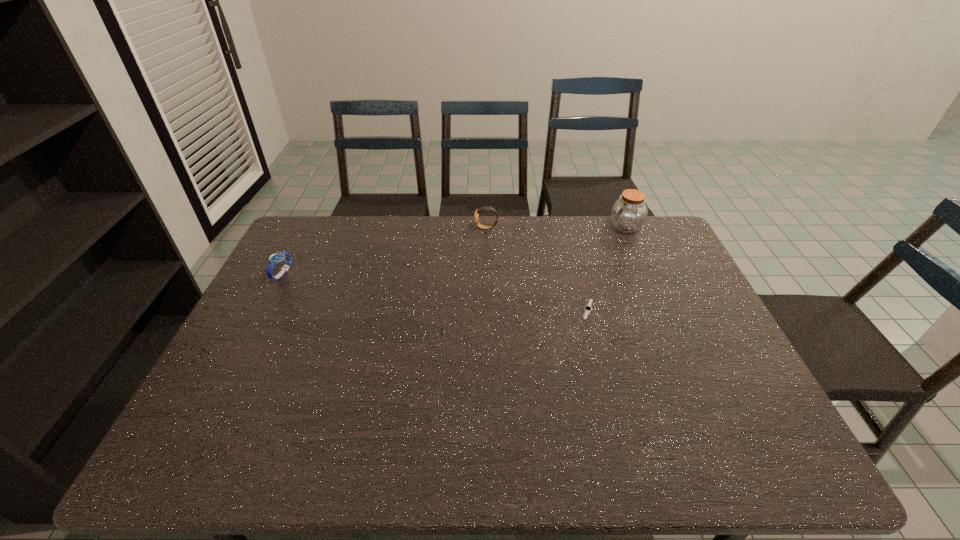
This screenshot has width=960, height=540. Find the location of `vacant space that satisfies the following two spatial constraints: 1. on the back side of the nearest watch; 2. on the left side of the jar`. vacant space that satisfies the following two spatial constraints: 1. on the back side of the nearest watch; 2. on the left side of the jar is located at coordinates (566, 227).

The height and width of the screenshot is (540, 960). Identify the location of free space that satisfies the following two spatial constraints: 1. on the back side of the nearest watch; 2. on the face of the tallest watch. (567, 228).

At what (x,y) coordinates should I click in order to perform the action: click on free space that satisfies the following two spatial constraints: 1. on the face of the shortest watch; 2. on the left side of the farthest watch. Please return your answer as a coordinate pair (x, y). Looking at the image, I should click on (489, 309).